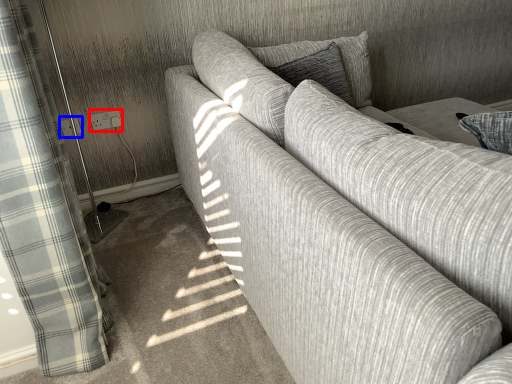
Question: Which object appears closest to the camera in this image, electric outlet (highlighted by a red box) or electric outlet (highlighted by a blue box)?

Choices:
 (A) electric outlet
 (B) electric outlet

Answer: (B)